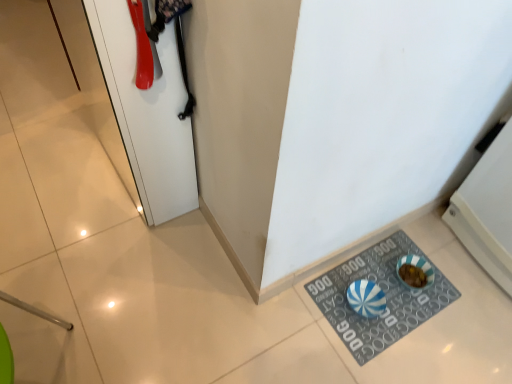
I want to click on free region under blue and white striped rubber mat at lower right (from a real-world perspective), so click(387, 309).